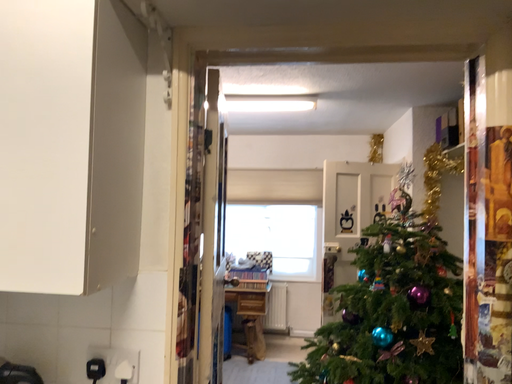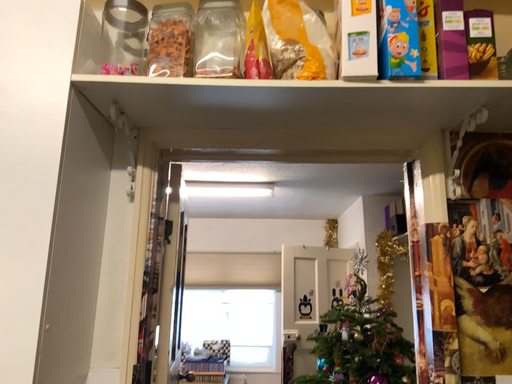
Question: How did the camera likely rotate when shooting the video?

Choices:
 (A) rotated upward
 (B) rotated downward

Answer: (A)